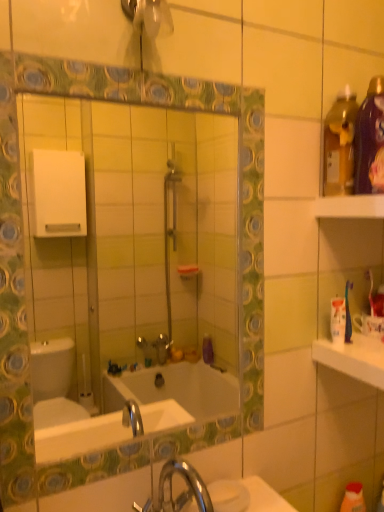
Question: Considering the positions of point pyautogui.click(x=125, y=241) and point pyautogui.click(x=319, y=198), is point pyautogui.click(x=125, y=241) closer or farther from the camera than point pyautogui.click(x=319, y=198)?

Choices:
 (A) farther
 (B) closer

Answer: (A)

Question: From their relative heights in the image, would you say green glossy mirror at center is taller or shorter than white plastic shelf at upper right?

Choices:
 (A) short
 (B) tall

Answer: (B)

Question: Considering the real-world distances, which object is closest to the white plastic shelf at upper right?

Choices:
 (A) white glossy countertop at right
 (B) green glossy mirror at center

Answer: (A)

Question: Which object is the closest to the green glossy mirror at center?

Choices:
 (A) white plastic shelf at upper right
 (B) white glossy countertop at right

Answer: (B)